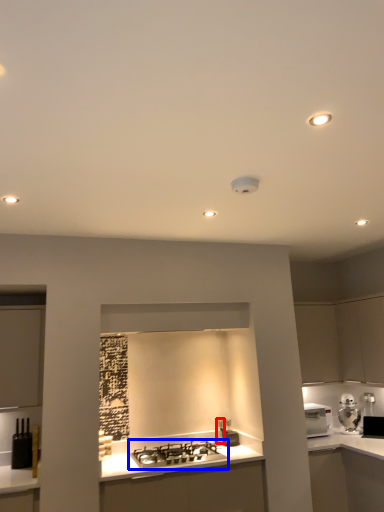
Question: Which object is closer to the camera taking this photo, faucet (highlighted by a red box) or gas stove (highlighted by a blue box)?

Choices:
 (A) faucet
 (B) gas stove

Answer: (B)